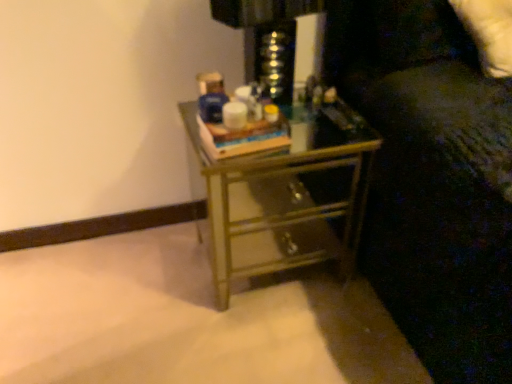
The image size is (512, 384). I want to click on free point below metallic gold nightstand at center (from a real-world perspective), so click(275, 269).